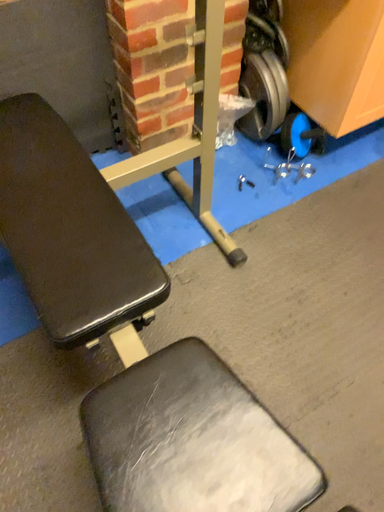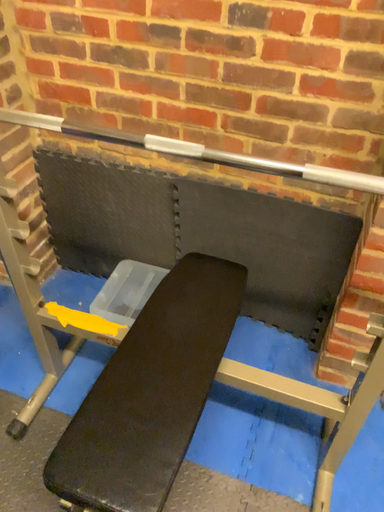
Question: Which way did the camera rotate in the video?

Choices:
 (A) rotated upward
 (B) rotated downward

Answer: (A)